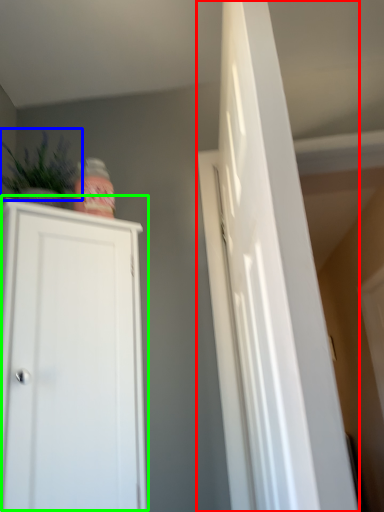
Question: Which object is positioned farthest from door (highlighted by a red box)? Select from plant (highlighted by a blue box) and cupboard (highlighted by a green box).

Choices:
 (A) plant
 (B) cupboard

Answer: (A)